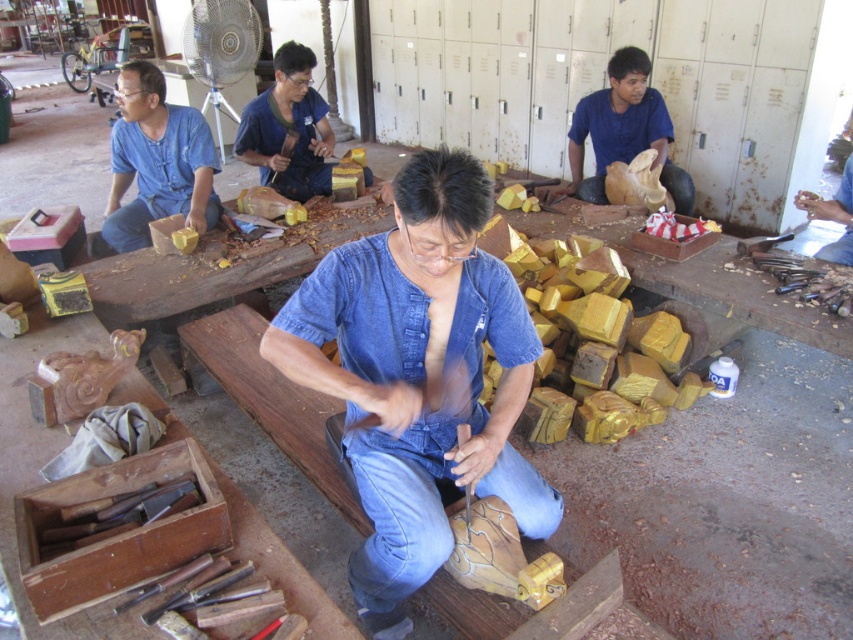
Question: Which object is farther from the camera taking this photo?

Choices:
 (A) jeans at center
 (B) denim jeans at center

Answer: (A)

Question: Which point is farther to the camera?

Choices:
 (A) matte blue shirt at center
 (B) jeans at center
 (C) denim jeans at center
 (D) blue denim jeans at center

Answer: (B)

Question: Is the position of matte blue shirt at center less distant than that of jeans at center?

Choices:
 (A) no
 (B) yes

Answer: (B)

Question: Among these objects, which one is nearest to the camera?

Choices:
 (A) jeans at center
 (B) denim jeans at center
 (C) denim shirt at center

Answer: (C)

Question: Is blue denim jeans at center positioned at the back of jeans at center?

Choices:
 (A) no
 (B) yes

Answer: (A)

Question: From the image, what is the correct spatial relationship of denim shirt at center in relation to matte blue shirt at center?

Choices:
 (A) below
 (B) above

Answer: (A)